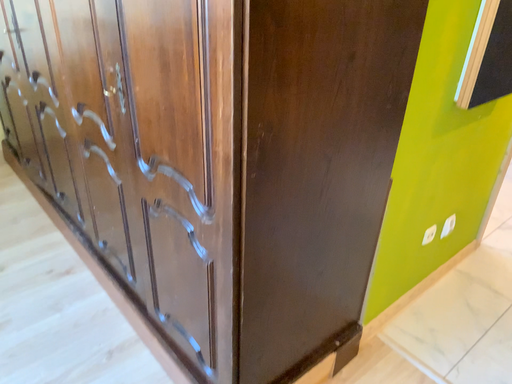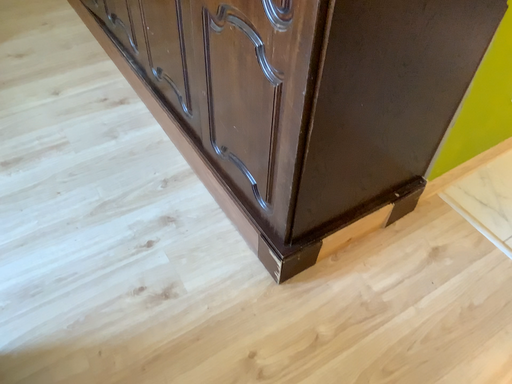
Question: How did the camera likely rotate when shooting the video?

Choices:
 (A) rotated upward
 (B) rotated downward

Answer: (B)